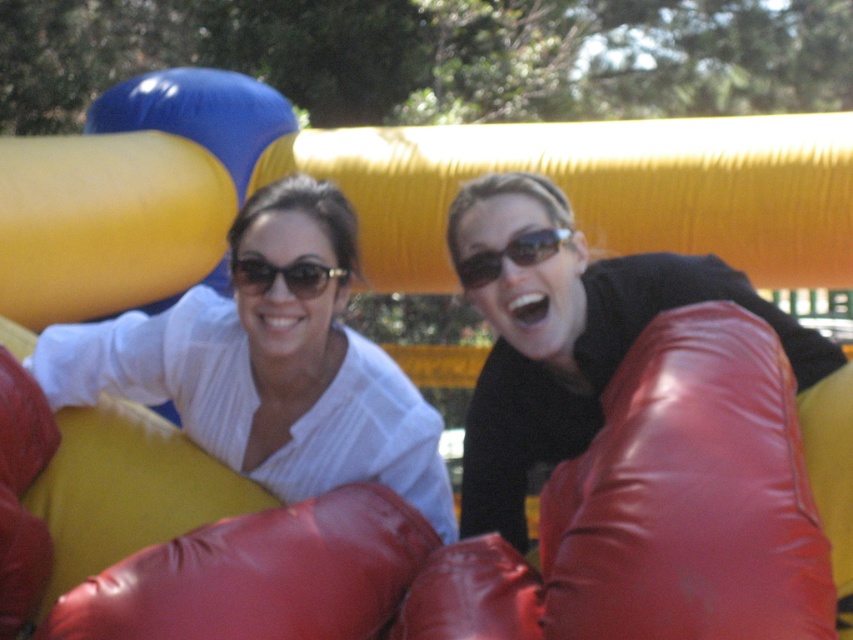
Is rubber-like red boxing glove at right bigger than sunglasses at center?

Yes, rubber-like red boxing glove at right is bigger than sunglasses at center.

Is point (625, 394) closer to camera compared to point (529, 262)?

Yes, it is in front of point (529, 262).

Where is `rubber-like red boxing glove at right`? Image resolution: width=853 pixels, height=640 pixels. rubber-like red boxing glove at right is located at coordinates (689, 496).

Which is more to the left, white striped shirt at upper left or rubber boxing glove at lower center?

Positioned to the left is white striped shirt at upper left.

Is point (271, 412) positioned before point (346, 525)?

No, it is not.

Locate an element on the screen. This screenshot has height=640, width=853. white striped shirt at upper left is located at coordinates (268, 368).

Who is shorter, white striped shirt at upper left or matte black sunglasses at center?

With less height is matte black sunglasses at center.

Find the location of `white striped shirt at upper left`. white striped shirt at upper left is located at coordinates pos(268,368).